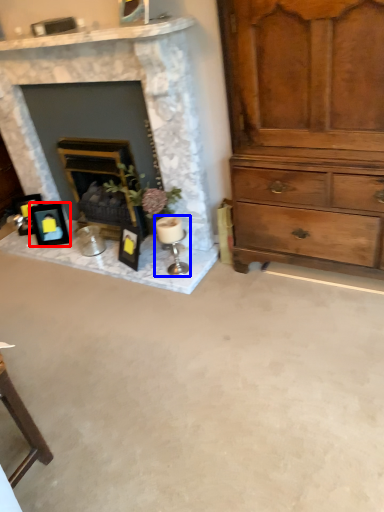
Question: Which of the following is the farthest to the observer, picture frame (highlighted by a red box) or candle holder (highlighted by a blue box)?

Choices:
 (A) picture frame
 (B) candle holder

Answer: (A)